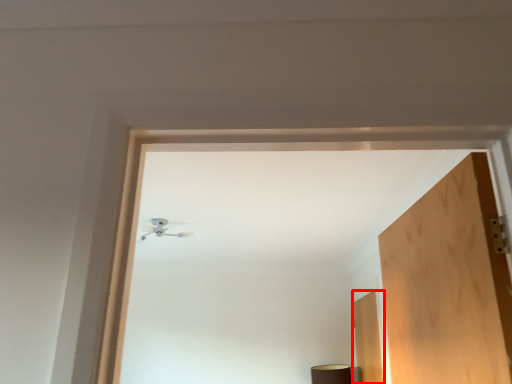
Question: From the image's perspective, where is door (annotated by the red box) located relative to lamp?

Choices:
 (A) above
 (B) below

Answer: (B)